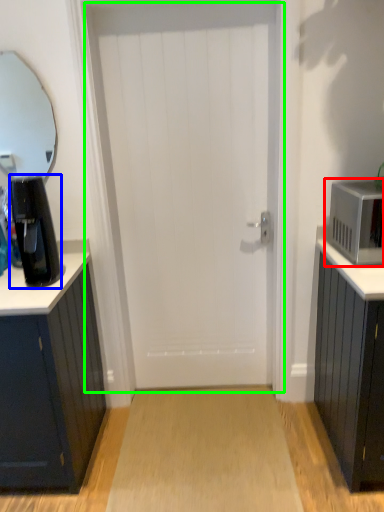
Question: Considering the real-world distances, which object is closest to microwave oven (highlighted by a red box)? coffee maker (highlighted by a blue box) or door (highlighted by a green box).

Choices:
 (A) coffee maker
 (B) door

Answer: (B)